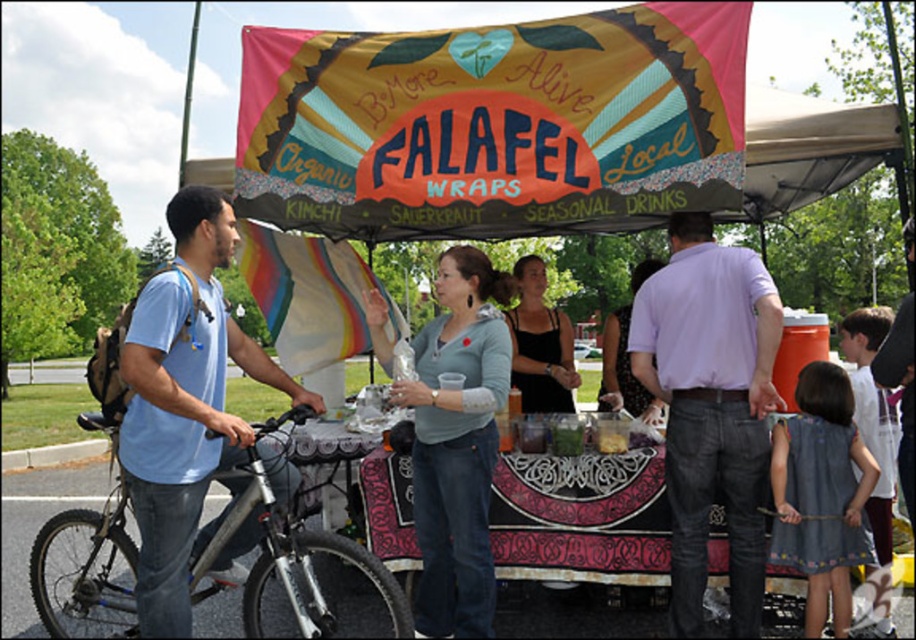
What is located at the coordinates point (458,444)?

The light blue sweater at center is located at point (458,444).